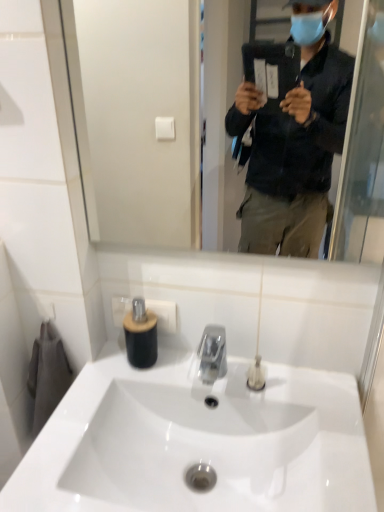
At what (x,y) coordinates should I click in order to perform the action: click on free space to the right of black matte soap dispenser at center, which is counted as the second toiletry, starting from the right. Please return your answer as a coordinate pair (x, y). The width and height of the screenshot is (384, 512). Looking at the image, I should click on (193, 368).